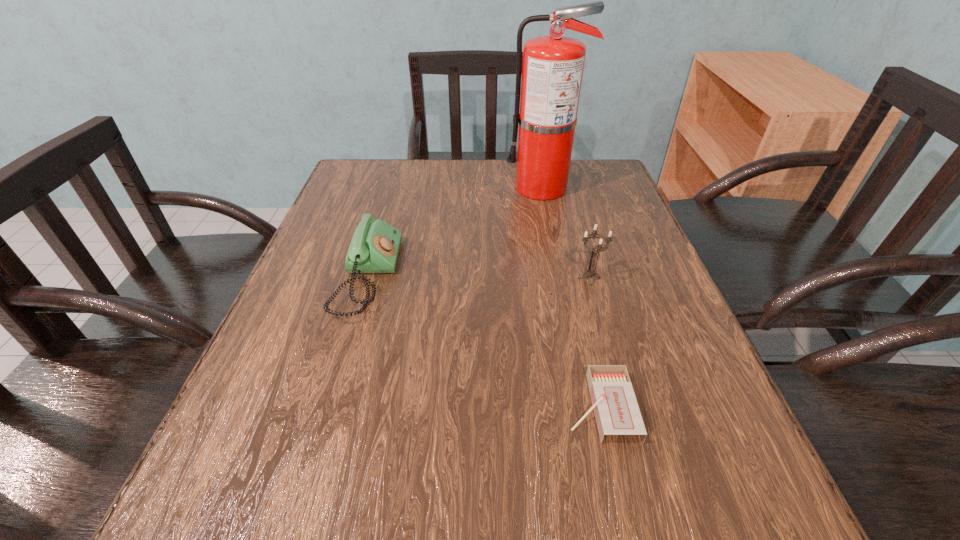
Find the location of a particular element. Image resolution: width=960 pixels, height=540 pixels. vacant space located on the back of the second tallest object is located at coordinates (582, 254).

Find the location of `free space located 0.290m on the dial of the telephone`. free space located 0.290m on the dial of the telephone is located at coordinates (540, 276).

Identify the location of vacant space located on the striking surface of the matchbox. (467, 407).

At what (x,y) coordinates should I click in order to perform the action: click on vacant space situated on the striking surface of the matchbox. Please return your answer as a coordinate pair (x, y). The height and width of the screenshot is (540, 960). Looking at the image, I should click on (373, 407).

Where is `vacant space located 0.090m on the striking surface of the matchbox`? vacant space located 0.090m on the striking surface of the matchbox is located at coordinates (507, 407).

Find the location of a particular element. object that is at the far edge is located at coordinates (552, 69).

This screenshot has width=960, height=540. Find the location of `object present at the left edge`. object present at the left edge is located at coordinates (374, 248).

Identify the location of fire extinguisher that is at the right edge. (552, 69).

Locate an element on the screen. This screenshot has height=540, width=960. candle holder that is at the right edge is located at coordinates (590, 272).

What are the coordinates of `matchbox that is positioned at the right edge` in the screenshot? It's located at (616, 410).